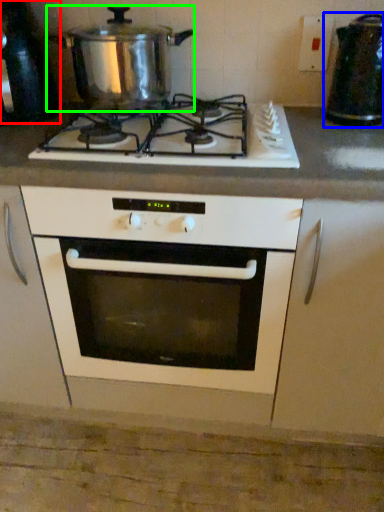
Question: Considering the real-world distances, which object is farthest from appliance (highlighted by a red box)? appliance (highlighted by a blue box) or kitchen appliance (highlighted by a green box)?

Choices:
 (A) appliance
 (B) kitchen appliance

Answer: (A)